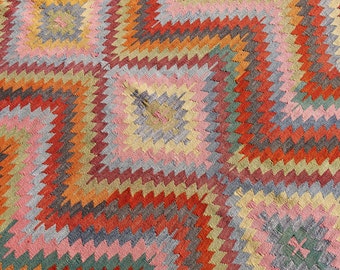
The image size is (340, 270). In order to click on diamond shaped pattern used to make rug or blanket in this screenshot , I will do `click(192, 75)`, `click(118, 143)`, `click(210, 163)`, `click(114, 70)`, `click(271, 195)`.